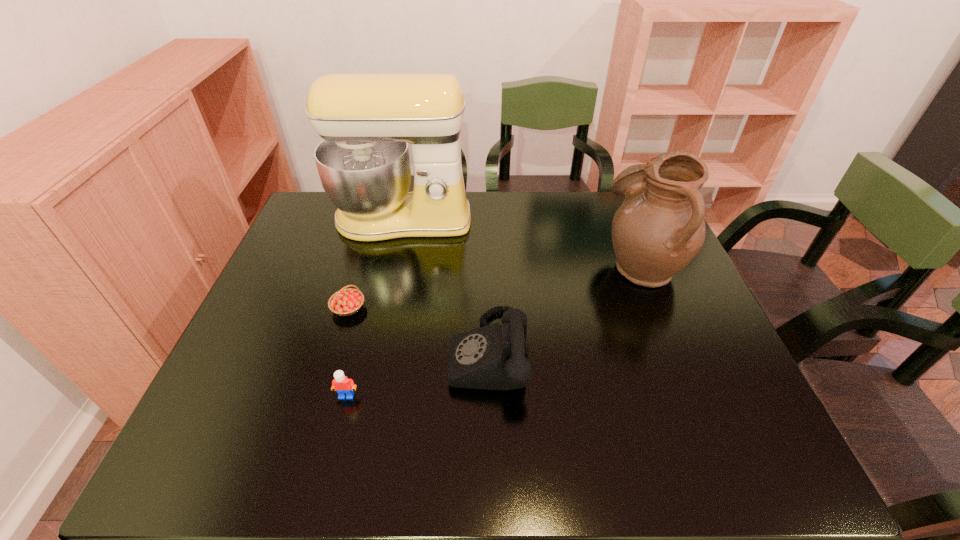
I want to click on mixer, so click(366, 120).

Image resolution: width=960 pixels, height=540 pixels. I want to click on pitcher, so click(659, 228).

Identify the location of the fourth shortest object. The image size is (960, 540). (659, 228).

The height and width of the screenshot is (540, 960). I want to click on telephone, so click(494, 357).

Find the location of a particular element. Lego is located at coordinates (344, 386).

The width and height of the screenshot is (960, 540). I want to click on the shortest object, so click(346, 302).

Find the location of a particular element. Image resolution: width=960 pixels, height=540 pixels. vacant area situated 0.150m on the side of the tallest object with the control knob is located at coordinates (389, 280).

Locate an element on the screen. This screenshot has width=960, height=540. free space located 0.190m at the spout of the rightmost object is located at coordinates (534, 265).

Find the location of a particular element. This screenshot has height=540, width=960. free region located 0.360m at the spout of the rightmost object is located at coordinates (473, 265).

Find the location of `vacant space located at the spout of the rightmost object`. vacant space located at the spout of the rightmost object is located at coordinates (566, 265).